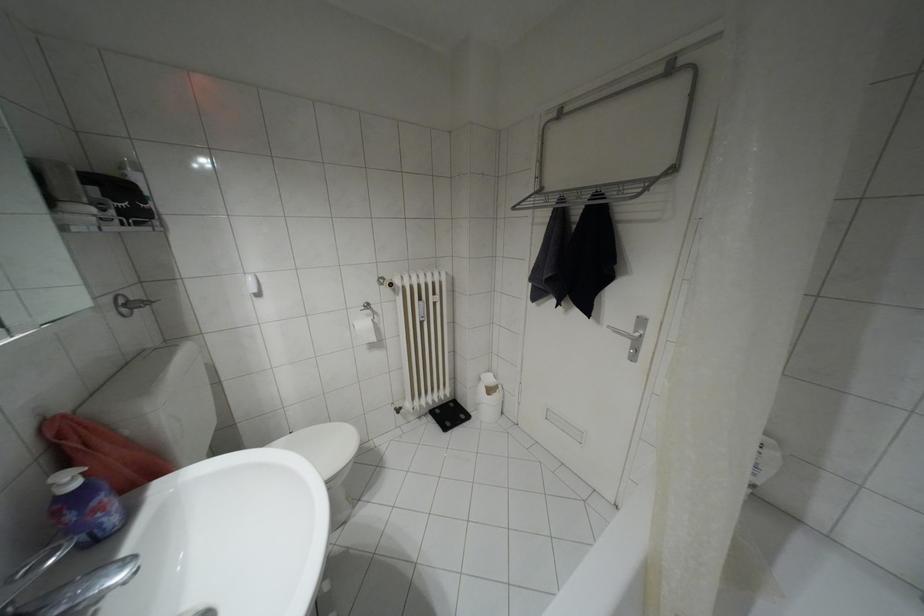
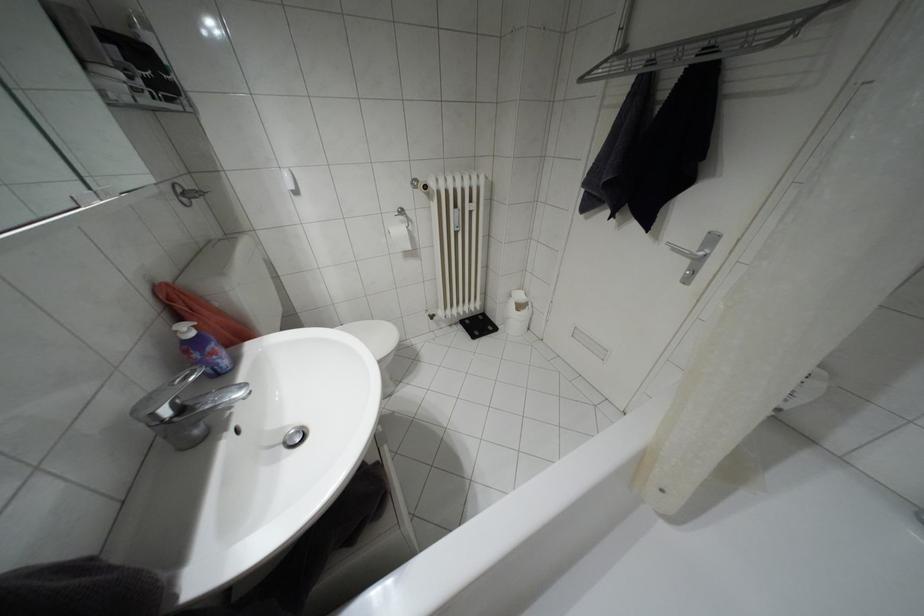
Locate, in the second image, the point that corresponds to the point at 444,428 in the first image.

(472, 336)